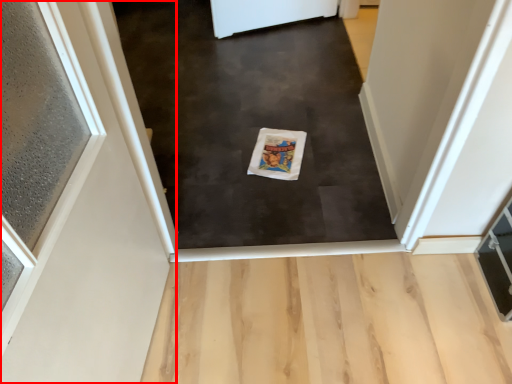
Question: From the image's perspective, where is door (annotated by the red box) located in relation to mat in the image?

Choices:
 (A) above
 (B) below

Answer: (B)